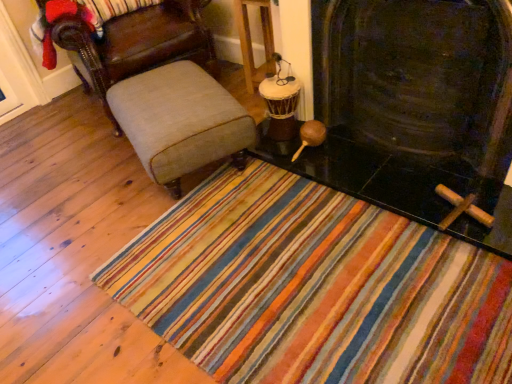
Question: Based on their positions, is beige fabric ottoman at center located to the left or right of light beige fabric chair at left?

Choices:
 (A) right
 (B) left

Answer: (A)

Question: From their relative heights in the image, would you say beige fabric ottoman at center is taller or shorter than light beige fabric chair at left?

Choices:
 (A) short
 (B) tall

Answer: (A)

Question: Considering the real-world distances, which object is farthest from the light beige fabric chair at left?

Choices:
 (A) wooden drum at center
 (B) beige fabric ottoman at center
 (C) black stone fireplace at center

Answer: (C)

Question: Estimate the real-world distances between objects in this image. Which object is closer to the light beige fabric chair at left?

Choices:
 (A) black stone fireplace at center
 (B) wooden drum at center
 (C) beige fabric ottoman at center

Answer: (C)